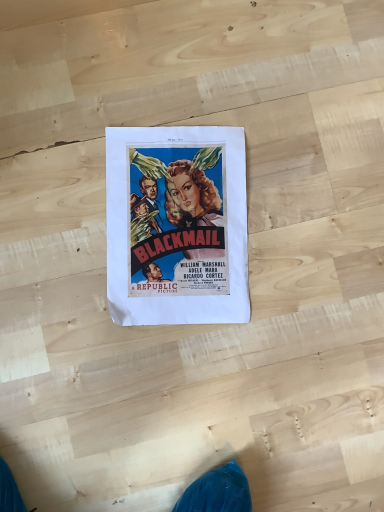
Question: Should I look upward or downward to see matte paper poster at center?

Choices:
 (A) up
 (B) down

Answer: (A)